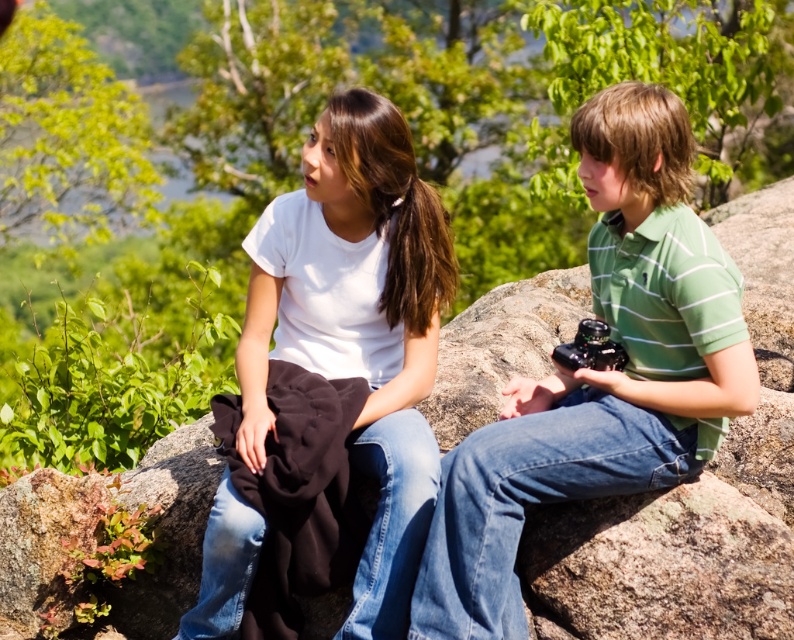
Is point (629, 308) closer to camera compared to point (369, 449)?

Yes, it is.

Does green striped polo shirt at right have a greater height compared to white matte t-shirt at center?

No, green striped polo shirt at right is not taller than white matte t-shirt at center.

Who is more distant from viewer, (x=684, y=387) or (x=422, y=499)?

Point (x=422, y=499)

Locate an element on the screen. green striped polo shirt at right is located at coordinates (599, 372).